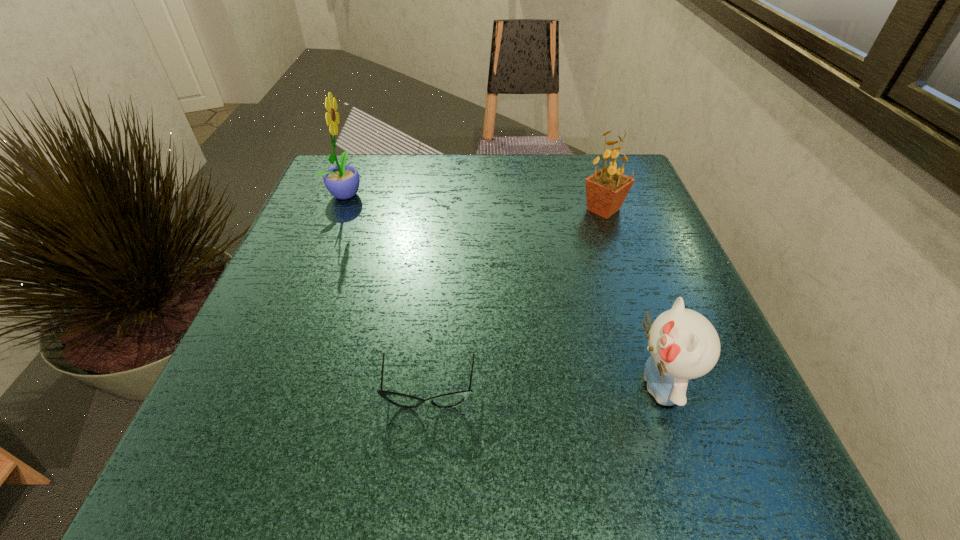
Locate an element on the screen. The width and height of the screenshot is (960, 540). the leftmost object is located at coordinates (342, 181).

Image resolution: width=960 pixels, height=540 pixels. What are the coordinates of `the left sunflower` in the screenshot? It's located at (342, 181).

I want to click on the shorter sunflower, so click(x=606, y=190).

Find the location of a particular element. The height and width of the screenshot is (540, 960). the second shortest object is located at coordinates (683, 344).

Image resolution: width=960 pixels, height=540 pixels. Find the location of `spectacles`. spectacles is located at coordinates (449, 400).

Locate an element on the screen. the shortest object is located at coordinates (449, 400).

The image size is (960, 540). I want to click on free location located on the front-facing side of the tallest object, so click(x=523, y=193).

Locate an element on the screen. free location located at the front of the right sunflower with flowers visible is located at coordinates coord(530,210).

Where is `vacant space located at the front of the right sunflower with flowers visible`? Image resolution: width=960 pixels, height=540 pixels. vacant space located at the front of the right sunflower with flowers visible is located at coordinates (426, 210).

The image size is (960, 540). What are the coordinates of `free spot located at the front of the right sunflower with flowers visible` in the screenshot? It's located at (408, 210).